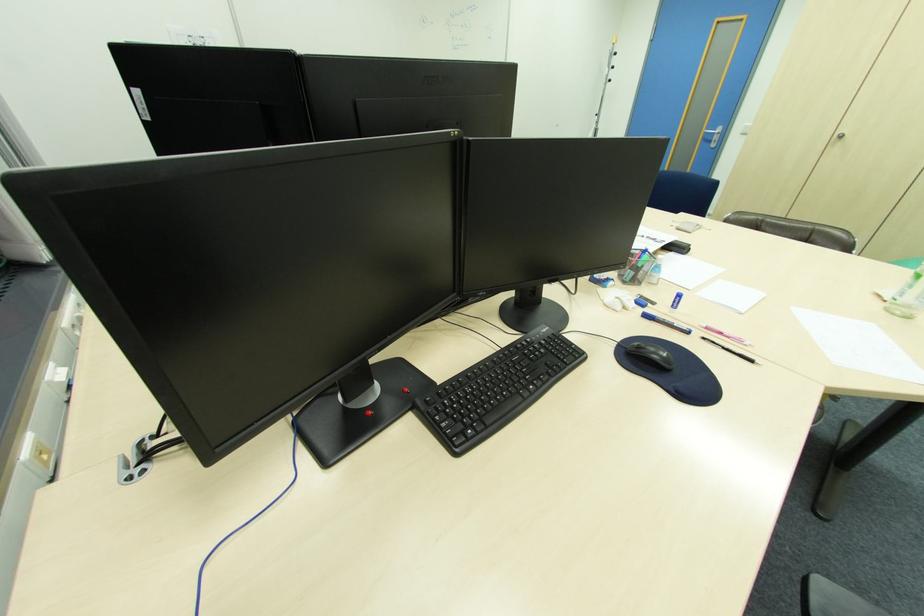
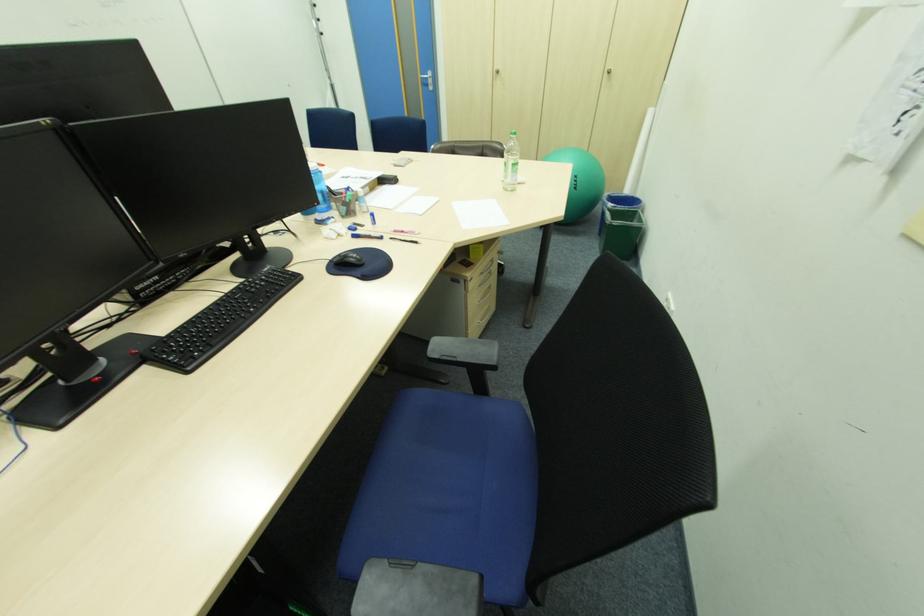
Locate, in the second image, the point that corresponds to pixel 662 358 in the first image.

(357, 260)